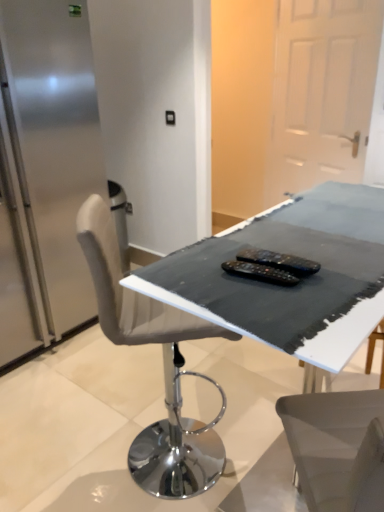
This screenshot has height=512, width=384. What are the coordinates of `white matte door at upper right` in the screenshot? It's located at (321, 92).

Describe the element at coordinates (279, 261) in the screenshot. I see `black plastic remote controls at center, the 1th equipment viewed from the top` at that location.

Image resolution: width=384 pixels, height=512 pixels. Identify the location of white matte door at upper right. (321, 92).

Between black fabric-covered table at center and satin silver fridge at left, which one has larger width?

With larger width is satin silver fridge at left.

Which object is positioned more to the left, black fabric-covered table at center or satin silver fridge at left?

satin silver fridge at left is more to the left.

From a real-world perspective, who is located lower, black fabric-covered table at center or satin silver fridge at left?

From a 3D spatial view, satin silver fridge at left is below.

Is black fabric-covered table at center oriented away from satin silver fridge at left?

That's right, black fabric-covered table at center is facing away from satin silver fridge at left.

Are white matte door at upper right and black plastic remote controls at center, the second equipment ordered from the bottom, making contact?

No.

Which of these two, white matte door at upper right or black plastic remote controls at center, the 1th equipment viewed from the top, is smaller?

Smaller between the two is black plastic remote controls at center, the 1th equipment viewed from the top.

Between white matte door at upper right and black plastic remote controls at center, the second equipment ordered from the bottom, which one has smaller width?

black plastic remote controls at center, the second equipment ordered from the bottom, is thinner.

Can you confirm if white matte door at upper right is positioned to the right of black plastic remote controls at center, the 1th equipment viewed from the top?

Indeed, white matte door at upper right is positioned on the right side of black plastic remote controls at center, the 1th equipment viewed from the top.

Is white matte door at upper right completely or partially inside black plastic remote controls at center, acting as the 1th equipment starting from the bottom?

No.

Is black plastic remote controls at center, arranged as the 2th equipment when viewed from the top, shorter than white matte door at upper right?

Correct, black plastic remote controls at center, arranged as the 2th equipment when viewed from the top, is not as tall as white matte door at upper right.

Which object is further away from the camera, black plastic remote controls at center, arranged as the 2th equipment when viewed from the top, or white matte door at upper right?

white matte door at upper right is behind.

Is point (232, 272) more distant than point (370, 37)?

No, it is not.

How different are the orientations of satin silver fridge at left and white matte door at upper right in degrees?

They differ by 110 degrees in their facing directions.

Would you say satin silver fridge at left is outside white matte door at upper right?

Absolutely, satin silver fridge at left is external to white matte door at upper right.

From a real-world perspective, is satin silver fridge at left above or below white matte door at upper right?

satin silver fridge at left is below white matte door at upper right.

From the picture: Which of these two, black fabric-covered table at center or black plastic remote controls at center, acting as the 1th equipment starting from the bottom, is wider?

With larger width is black fabric-covered table at center.

Is black plastic remote controls at center, arranged as the 2th equipment when viewed from the top, completely or partially inside black fabric-covered table at center?

Yes, black plastic remote controls at center, arranged as the 2th equipment when viewed from the top, is inside black fabric-covered table at center.

Does point (357, 195) come behind point (291, 285)?

Yes, it is behind point (291, 285).

From the image's perspective, between black fabric-covered table at center and black plastic remote controls at center, arranged as the 2th equipment when viewed from the top, which one is located above?

black fabric-covered table at center appears higher in the image.

Is black plastic remote controls at center, arranged as the 2th equipment when viewed from the top, at the right side of black fabric-covered table at center?

No, black plastic remote controls at center, arranged as the 2th equipment when viewed from the top, is not to the right of black fabric-covered table at center.

Is black fabric-covered table at center completely or partially inside black plastic remote controls at center, arranged as the 2th equipment when viewed from the top?

No, black plastic remote controls at center, arranged as the 2th equipment when viewed from the top, does not contain black fabric-covered table at center.

Which of these two, black plastic remote controls at center, arranged as the 2th equipment when viewed from the top, or black fabric-covered table at center, is smaller?

black plastic remote controls at center, arranged as the 2th equipment when viewed from the top, is smaller.

You are a GUI agent. You are given a task and a screenshot of the screen. Output one action in this format:
    pyautogui.click(x=<x>, y=<y>)
    Task: Click on the table located underneath the black plastic remote controls at center, acting as the 1th equipment starting from the bottom (from a real-world perspective)
    Image resolution: width=384 pixels, height=512 pixels.
    Given the screenshot: What is the action you would take?
    pyautogui.click(x=293, y=287)

Does black plastic remote controls at center, the second equipment ordered from the bottom, appear on the left side of white matte door at upper right?

Indeed, black plastic remote controls at center, the second equipment ordered from the bottom, is positioned on the left side of white matte door at upper right.

Which is behind, point (272, 257) or point (300, 144)?

The point (300, 144) is behind.

Is black plastic remote controls at center, the 1th equipment viewed from the top, far from white matte door at upper right?

black plastic remote controls at center, the 1th equipment viewed from the top, is far away from white matte door at upper right.

Is the position of black plastic remote controls at center, the 1th equipment viewed from the top, less distant than that of white matte door at upper right?

Yes, black plastic remote controls at center, the 1th equipment viewed from the top, is closer to the viewer.

Identify the location of table located on the right of satin silver fridge at left. (293, 287).

Find the location of a particular element. The width and height of the screenshot is (384, 512). the 1st equipment to the left of the white matte door at upper right, starting your count from the anchor is located at coordinates (279, 261).

Which object lies further to the anchor point black fabric-covered table at center, white matte door at upper right or black plastic remote controls at center, the 1th equipment viewed from the top?

white matte door at upper right lies further to black fabric-covered table at center than the other object.

Looking at the image, which one is located further to black plastic remote controls at center, arranged as the 2th equipment when viewed from the top, white matte door at upper right or black fabric-covered table at center?

white matte door at upper right is positioned further to the anchor black plastic remote controls at center, arranged as the 2th equipment when viewed from the top.

When comparing their distances from white matte door at upper right, does satin silver fridge at left or black plastic remote controls at center, acting as the 1th equipment starting from the bottom, seem further?

The object further to white matte door at upper right is black plastic remote controls at center, acting as the 1th equipment starting from the bottom.

Based on their spatial positions, is black fabric-covered table at center or black plastic remote controls at center, acting as the 1th equipment starting from the bottom, further from black plastic remote controls at center, the second equipment ordered from the bottom?

The object further to black plastic remote controls at center, the second equipment ordered from the bottom, is black fabric-covered table at center.

From the picture: Which object lies further to the anchor point black plastic remote controls at center, arranged as the 2th equipment when viewed from the top, satin silver fridge at left or black fabric-covered table at center?

satin silver fridge at left.

Considering their positions, is black plastic remote controls at center, the second equipment ordered from the bottom, positioned closer to satin silver fridge at left than black plastic remote controls at center, arranged as the 2th equipment when viewed from the top?

black plastic remote controls at center, the second equipment ordered from the bottom, is closer to satin silver fridge at left.

Estimate the real-world distances between objects in this image. Which object is closer to black plastic remote controls at center, acting as the 1th equipment starting from the bottom, black plastic remote controls at center, the 1th equipment viewed from the top, or satin silver fridge at left?

black plastic remote controls at center, the 1th equipment viewed from the top, lies closer to black plastic remote controls at center, acting as the 1th equipment starting from the bottom, than the other object.

Considering their positions, is black plastic remote controls at center, the 1th equipment viewed from the top, positioned further to black plastic remote controls at center, arranged as the 2th equipment when viewed from the top, than white matte door at upper right?

white matte door at upper right.

Locate an element on the screen. table between satin silver fridge at left and white matte door at upper right from left to right is located at coordinates (293, 287).

You are a GUI agent. You are given a task and a screenshot of the screen. Output one action in this format:
    pyautogui.click(x=<x>, y=<y>)
    Task: Click on the equipment between satin silver fridge at left and black plastic remote controls at center, the 1th equipment viewed from the top, from left to right
    This screenshot has width=384, height=512.
    Given the screenshot: What is the action you would take?
    pyautogui.click(x=260, y=272)

This screenshot has width=384, height=512. I want to click on equipment between black fabric-covered table at center and black plastic remote controls at center, the 1th equipment viewed from the top, in the front-back direction, so click(x=260, y=272).

This screenshot has height=512, width=384. In order to click on equipment between black plastic remote controls at center, acting as the 1th equipment starting from the bottom, and white matte door at upper right from front to back in this screenshot , I will do `click(279, 261)`.